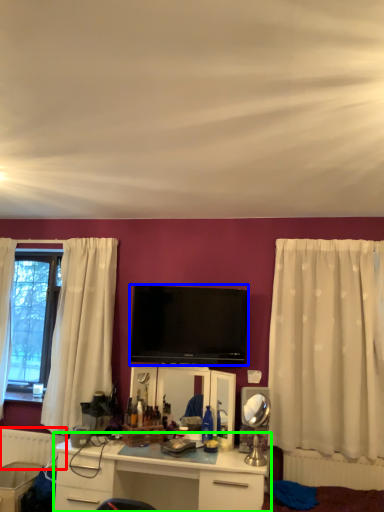
Question: Estimate the real-world distances between objects in this image. Which object is closer to radiator (highlighted by a red box), television (highlighted by a blue box) or desk (highlighted by a green box)?

Choices:
 (A) television
 (B) desk

Answer: (B)